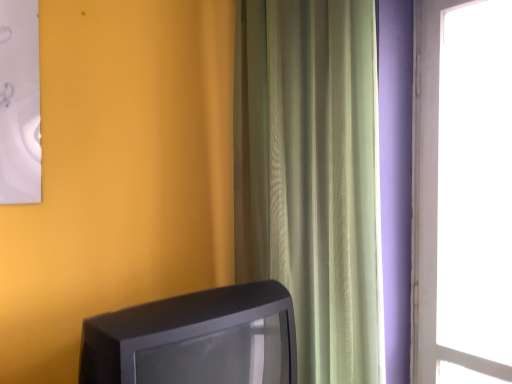
Describe the element at coordinates (190, 338) in the screenshot. I see `matte black television at lower left` at that location.

You are a GUI agent. You are given a task and a screenshot of the screen. Output one action in this format:
    pyautogui.click(x=<x>, y=<y>)
    Task: Click on the matte black television at lower left
    The image size is (512, 384).
    Given the screenshot: What is the action you would take?
    pyautogui.click(x=190, y=338)

What is the approximate width of green textured curtain at center?

green textured curtain at center is 6.21 inches in width.

The image size is (512, 384). I want to click on green textured curtain at center, so click(x=311, y=175).

The image size is (512, 384). Describe the element at coordinates (311, 175) in the screenshot. I see `green textured curtain at center` at that location.

What is the approximate height of green textured curtain at center?

It is 4.34 feet.

At what (x,y) coordinates should I click in order to perform the action: click on matte black television at lower left. Please return your answer as a coordinate pair (x, y). This screenshot has height=384, width=512. Looking at the image, I should click on (190, 338).

Visually, is green textured curtain at center positioned to the left or to the right of matte black television at lower left?

In the image, green textured curtain at center appears on the right side of matte black television at lower left.

Considering the relative positions of green textured curtain at center and matte black television at lower left in the image provided, is green textured curtain at center behind matte black television at lower left?

Yes.

Is point (338, 358) farther from viewer compared to point (170, 343)?

That is True.

From the image's perspective, which is below, green textured curtain at center or matte black television at lower left?

matte black television at lower left, from the image's perspective.

From a real-world perspective, is green textured curtain at center over matte black television at lower left?

Correct, in the physical world, green textured curtain at center is higher than matte black television at lower left.

Is green textured curtain at center wider or thinner than matte black television at lower left?

Clearly, green textured curtain at center has less width compared to matte black television at lower left.

Who is shorter, green textured curtain at center or matte black television at lower left?

matte black television at lower left is shorter.

Between green textured curtain at center and matte black television at lower left, which one has smaller size?

With smaller size is matte black television at lower left.

Can we say green textured curtain at center lies outside matte black television at lower left?

green textured curtain at center is positioned outside matte black television at lower left.

Looking at this image, is green textured curtain at center beside matte black television at lower left?

There is a gap between green textured curtain at center and matte black television at lower left.

Is green textured curtain at center positioned with its back to matte black television at lower left?

green textured curtain at center is not turned away from matte black television at lower left.

Find the location of `curtain located above the matte black television at lower left (from the image's perspective)`. curtain located above the matte black television at lower left (from the image's perspective) is located at coordinates (311, 175).

Can you confirm if matte black television at lower left is positioned to the left of green textured curtain at center?

Yes.

In the image, is matte black television at lower left positioned in front of or behind green textured curtain at center?

Visually, matte black television at lower left is located in front of green textured curtain at center.

Considering the positions of point (180, 346) and point (352, 366), is point (180, 346) closer or farther from the camera than point (352, 366)?

Clearly, point (180, 346) is closer to the camera than point (352, 366).

From the image's perspective, between matte black television at lower left and green textured curtain at center, which one is located above?

green textured curtain at center is shown above in the image.

From a real-world perspective, is matte black television at lower left physically above green textured curtain at center?

No, from a real-world perspective, matte black television at lower left is not over green textured curtain at center

From the picture: Considering the relative sizes of matte black television at lower left and green textured curtain at center in the image provided, is matte black television at lower left thinner than green textured curtain at center?

No, matte black television at lower left is not thinner than green textured curtain at center.

Considering the sizes of objects matte black television at lower left and green textured curtain at center in the image provided, who is taller, matte black television at lower left or green textured curtain at center?

With more height is green textured curtain at center.

Considering the sizes of objects matte black television at lower left and green textured curtain at center in the image provided, who is bigger, matte black television at lower left or green textured curtain at center?

Bigger between the two is green textured curtain at center.

Is green textured curtain at center a part of matte black television at lower left?

Actually, green textured curtain at center is outside matte black television at lower left.

Is matte black television at lower left touching green textured curtain at center?

No, matte black television at lower left is not next to green textured curtain at center.

Could you tell me if matte black television at lower left is facing green textured curtain at center?

No, matte black television at lower left is not oriented towards green textured curtain at center.

How distant is matte black television at lower left from green textured curtain at center?

matte black television at lower left and green textured curtain at center are 14.94 inches apart.

This screenshot has width=512, height=384. Find the location of `curtain behind the matte black television at lower left`. curtain behind the matte black television at lower left is located at coordinates (311, 175).

Find the location of a particular element. Image resolution: width=512 pixels, height=384 pixels. curtain that is above the matte black television at lower left (from the image's perspective) is located at coordinates (311, 175).

Locate an element on the screen. The image size is (512, 384). curtain above the matte black television at lower left (from a real-world perspective) is located at coordinates (311, 175).